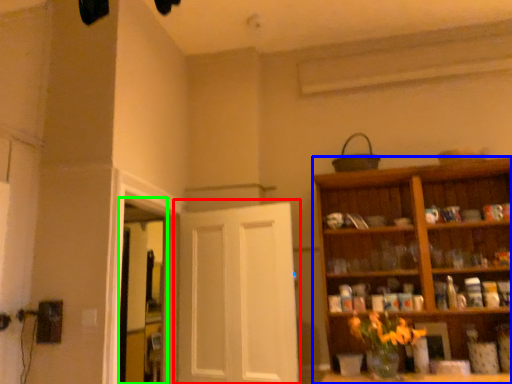
Question: Which object is the farthest from door (highlighted by a red box)? Choose among these: cabinetry (highlighted by a blue box) or window (highlighted by a green box).

Choices:
 (A) cabinetry
 (B) window

Answer: (A)